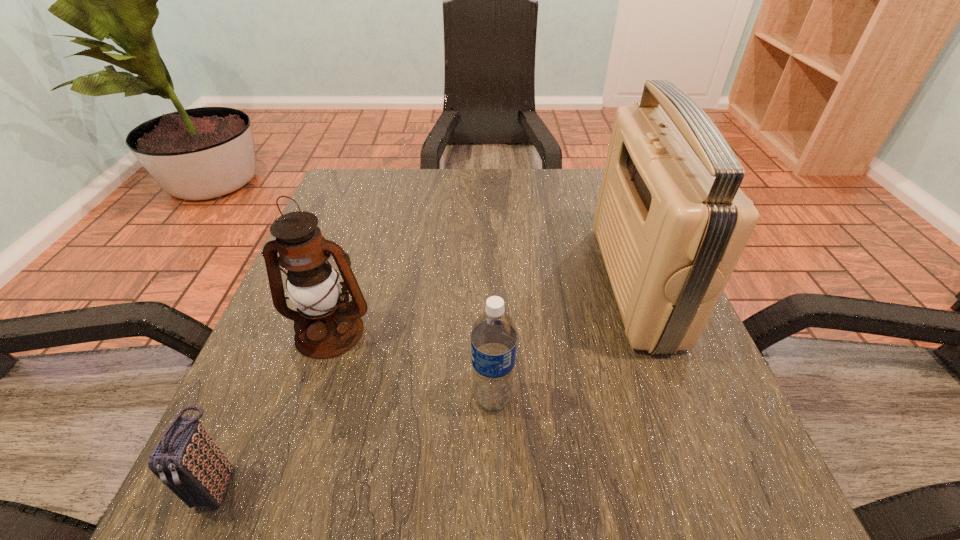
In the image, there is a desktop. Where is `vacant space at the near left corner`? vacant space at the near left corner is located at coordinates (318, 495).

In the image, there is a desktop. What are the coordinates of `vacant space at the far right corner` in the screenshot? It's located at (565, 194).

Find the location of a particular element. Image resolution: width=960 pixels, height=540 pixels. vacant space at the near right corner of the desktop is located at coordinates (735, 482).

Find the location of `free space between the radio receiver and the third shortest object`. free space between the radio receiver and the third shortest object is located at coordinates (482, 307).

Where is `free space between the second nearest object and the lantern`? free space between the second nearest object and the lantern is located at coordinates (411, 365).

In order to click on free space between the radio receiver and the lantern in this screenshot , I will do (x=482, y=307).

Find the location of a particular element. unoccupied position between the second tallest object and the radio receiver is located at coordinates (482, 307).

This screenshot has width=960, height=540. What are the coordinates of `free space between the nearest object and the third object from left to right` in the screenshot? It's located at (355, 441).

The width and height of the screenshot is (960, 540). Find the location of `vacant region between the radio receiver and the clutch bag`. vacant region between the radio receiver and the clutch bag is located at coordinates (426, 383).

The width and height of the screenshot is (960, 540). I want to click on vacant point located between the radio receiver and the shortest object, so click(x=426, y=383).